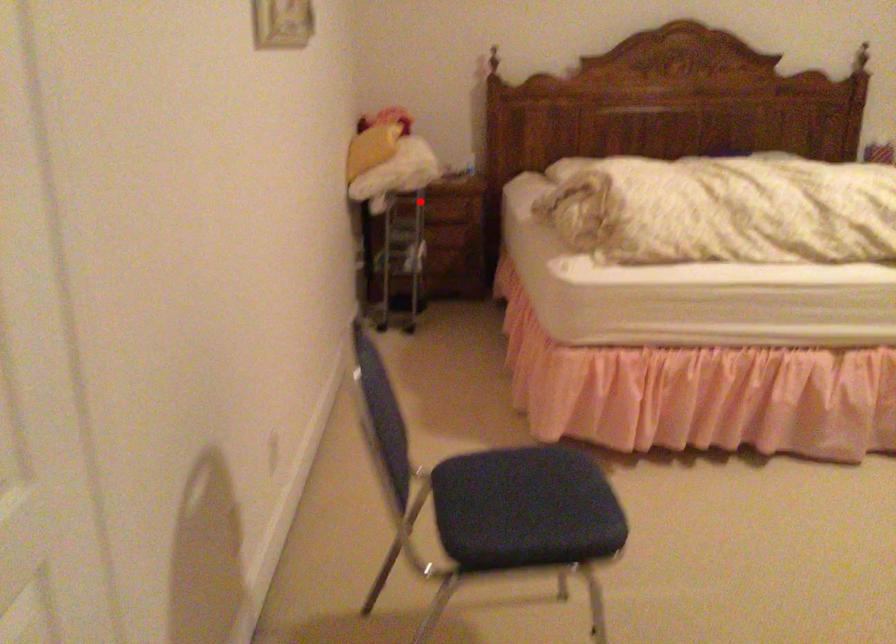
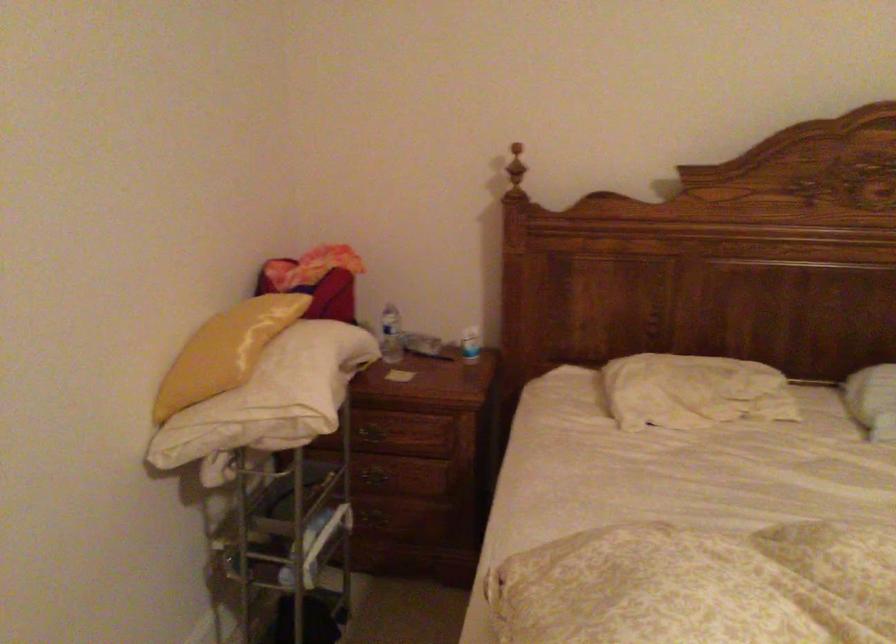
In the second image, find the point that corresponds to the highlighted location in the first image.

(374, 430)